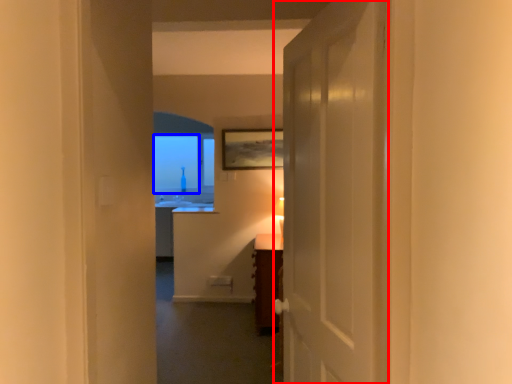
Question: Which object is further to the camera taking this photo, door (highlighted by a red box) or window screen (highlighted by a blue box)?

Choices:
 (A) door
 (B) window screen

Answer: (B)